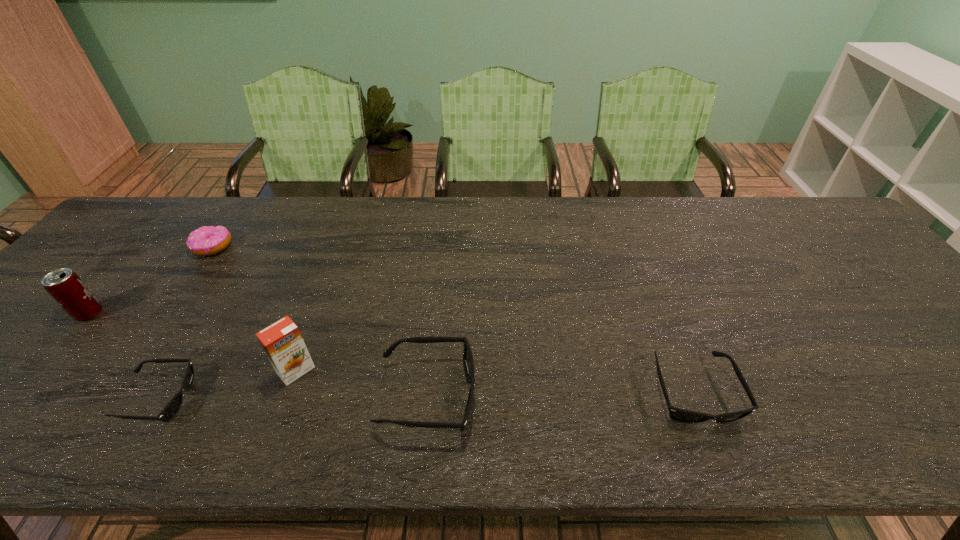
In the image, there is a desktop. Where is `vacant space at the far left corner`? The width and height of the screenshot is (960, 540). vacant space at the far left corner is located at coordinates (158, 206).

I want to click on vacant region at the far right corner, so click(801, 231).

The width and height of the screenshot is (960, 540). Find the location of `vacant area between the beer can and the doughnut`. vacant area between the beer can and the doughnut is located at coordinates (151, 280).

The height and width of the screenshot is (540, 960). I want to click on free space between the leftmost sunglasses and the doughnut, so click(x=185, y=323).

Locate an element on the screen. This screenshot has height=540, width=960. vacant area that lies between the tallest sunglasses and the second tallest sunglasses is located at coordinates (561, 394).

Locate an element on the screen. The image size is (960, 540). unoccupied position between the rightmost object and the shortest sunglasses is located at coordinates (425, 395).

At what (x,y) coordinates should I click in order to perform the action: click on blank region between the leftmost sunglasses and the second sunglasses from left to right. Please return your answer as a coordinate pair (x, y). Image resolution: width=960 pixels, height=540 pixels. Looking at the image, I should click on (293, 397).

Image resolution: width=960 pixels, height=540 pixels. Identify the location of empty space between the rightmost sunglasses and the doughnut. coord(453,320).

Find the location of a particular element. The height and width of the screenshot is (540, 960). free spot between the tallest sunglasses and the orange juice is located at coordinates (362, 383).

The image size is (960, 540). I want to click on free spot between the third tallest object and the second shortest sunglasses, so click(561, 394).